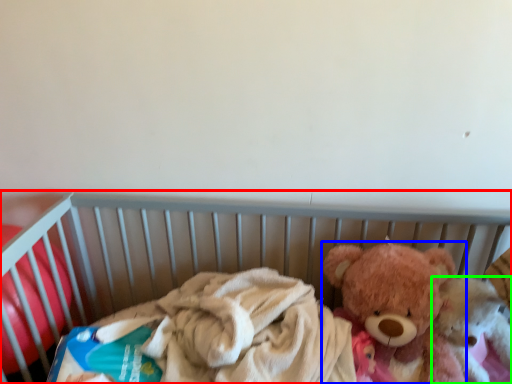
Question: Which is farther away from infant bed (highlighted by a red box)? teddy bear (highlighted by a blue box) or teddy bear (highlighted by a green box)?

Choices:
 (A) teddy bear
 (B) teddy bear

Answer: (B)